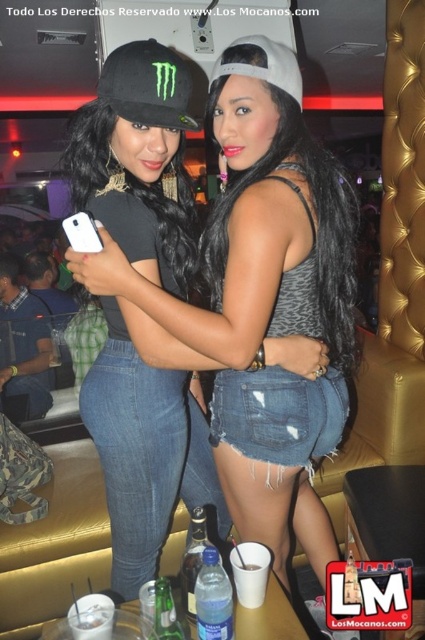
Question: Estimate the real-world distances between objects in this image. Which object is farther from the black matte baseball cap at upper left?

Choices:
 (A) black matte cap at upper left
 (B) green glass bottle at lower left
 (C) clear plastic bottle at center

Answer: (B)

Question: Estimate the real-world distances between objects in this image. Which object is farther from the white matte smartphone at upper left?

Choices:
 (A) black matte cap at upper left
 (B) green glass bottle at lower left
 (C) clear plastic bottle at center
 (D) clear plastic bottle at lower center

Answer: (B)

Question: Is black matte baseball cap at upper left further to the viewer compared to clear plastic bottle at center?

Choices:
 (A) no
 (B) yes

Answer: (A)

Question: Can you confirm if clear plastic bottle at lower center is positioned below clear plastic bottle at center?

Choices:
 (A) no
 (B) yes

Answer: (B)

Question: Which of these objects is positioned closest to the clear plastic bottle at center?

Choices:
 (A) white matte smartphone at upper left
 (B) black matte cap at upper left

Answer: (B)

Question: From the image, what is the correct spatial relationship of black matte cap at upper left in relation to white matte smartphone at upper left?

Choices:
 (A) below
 (B) above

Answer: (A)